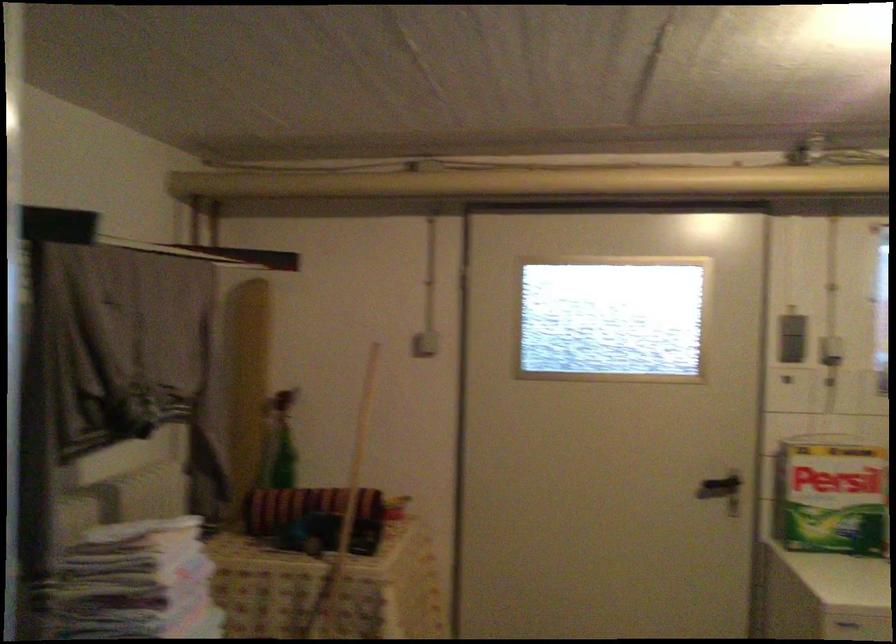
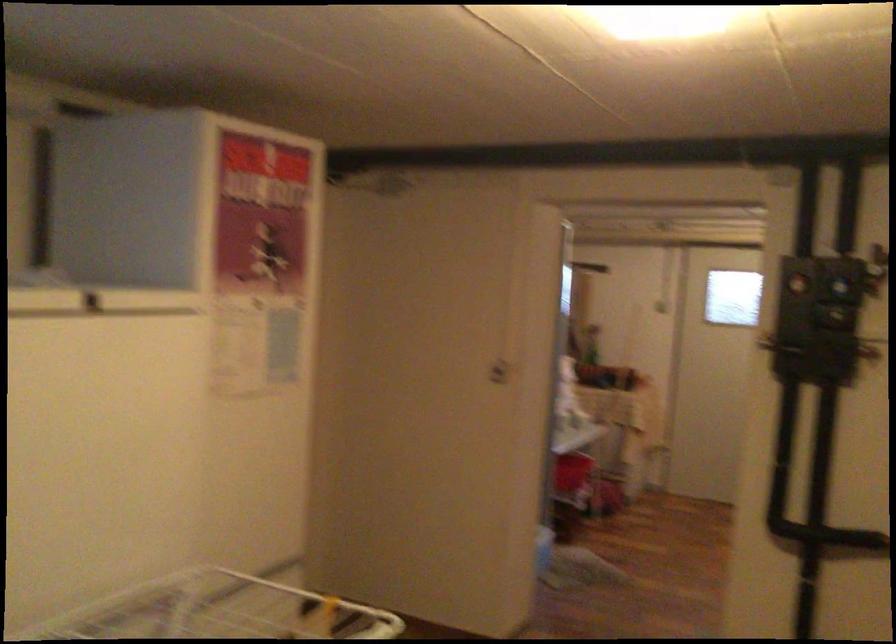
Question: I am providing you with two images of the same scene from different viewpoints. Which of the following objects are not visible in image2?

Choices:
 (A) white door handle
 (B) blue control dial
 (C) dark door handle
 (D) red frame handle

Answer: (C)